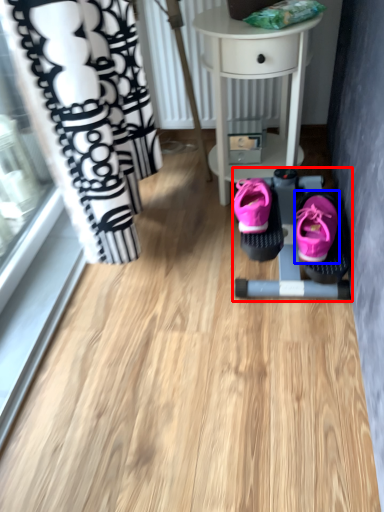
Question: Which object appears farthest to the camera in this image, baby carriage (highlighted by a red box) or footwear (highlighted by a blue box)?

Choices:
 (A) baby carriage
 (B) footwear

Answer: (A)